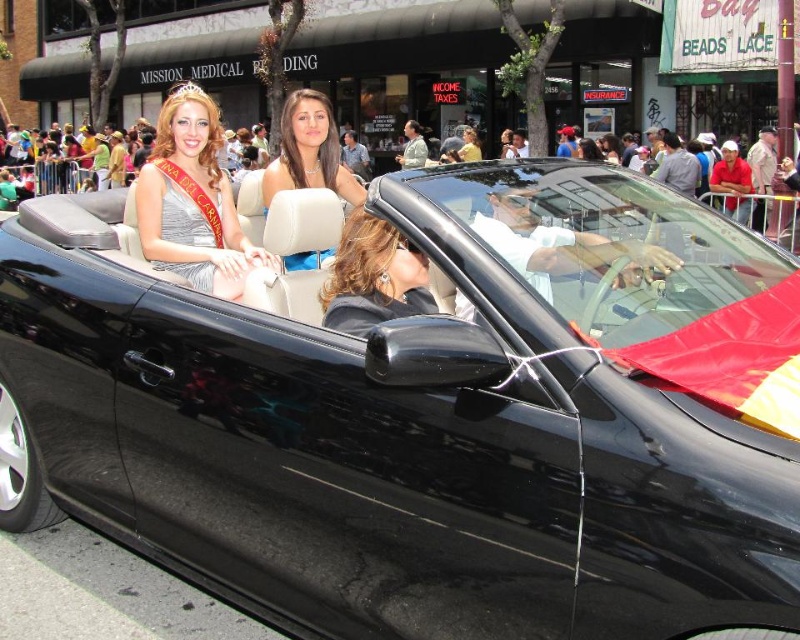
Question: Considering the relative positions of satin silver dress at upper left and blue satin dress at center in the image provided, where is satin silver dress at upper left located with respect to blue satin dress at center?

Choices:
 (A) right
 (B) left

Answer: (B)

Question: Is shiny black hair at center above blue satin dress at center?

Choices:
 (A) yes
 (B) no

Answer: (B)

Question: Which point is farther to the camera?

Choices:
 (A) blue satin dress at center
 (B) shiny black hair at center

Answer: (A)

Question: Does satin silver dress at upper left appear under shiny black hair at center?

Choices:
 (A) yes
 (B) no

Answer: (B)

Question: Which of the following is the closest to the observer?

Choices:
 (A) (413, 291)
 (B) (298, 186)
 (C) (210, 272)

Answer: (A)

Question: Estimate the real-world distances between objects in this image. Which object is closer to the shiny black hair at center?

Choices:
 (A) blue satin dress at center
 (B) satin silver dress at upper left

Answer: (B)